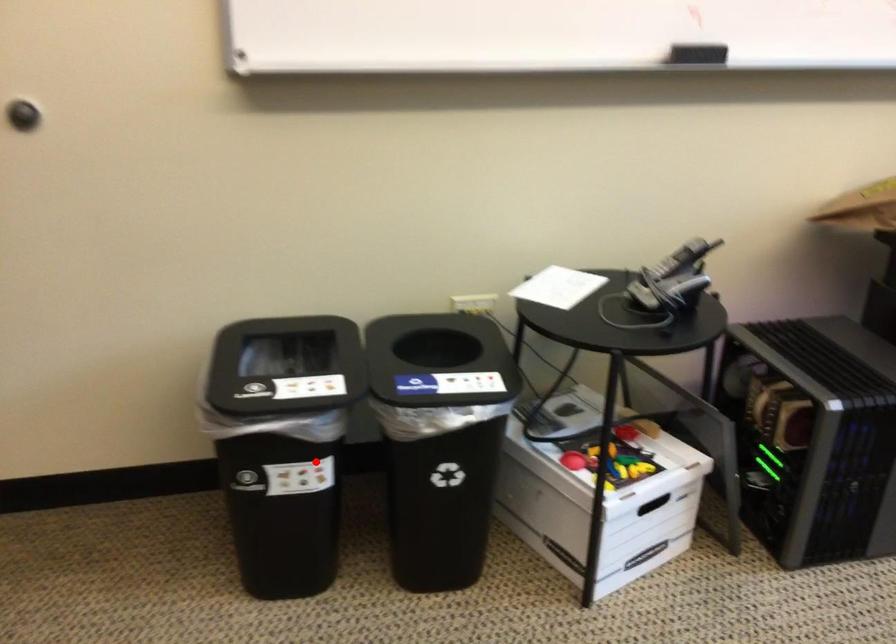
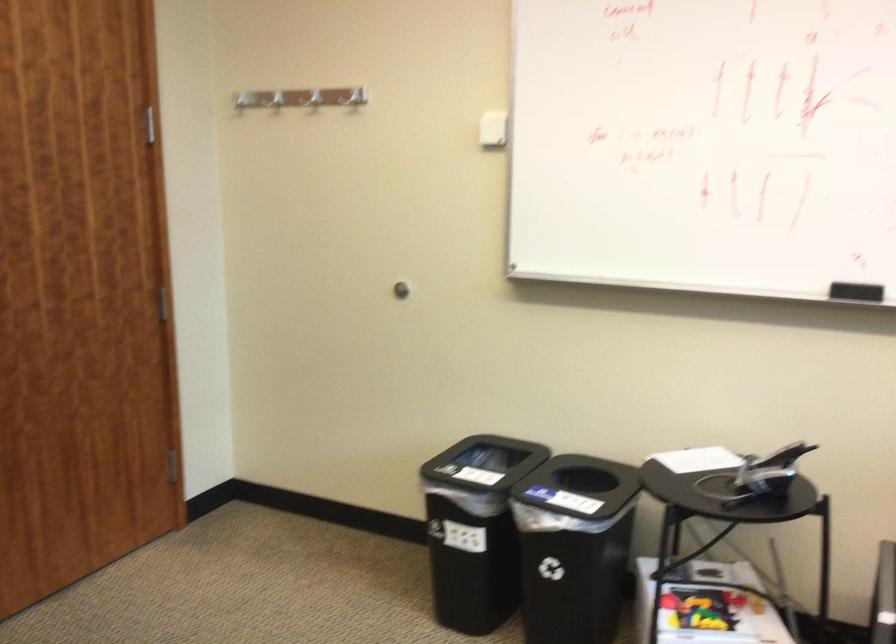
Where in the second image is the point corresponding to the highlighted location from the first image?

(475, 529)